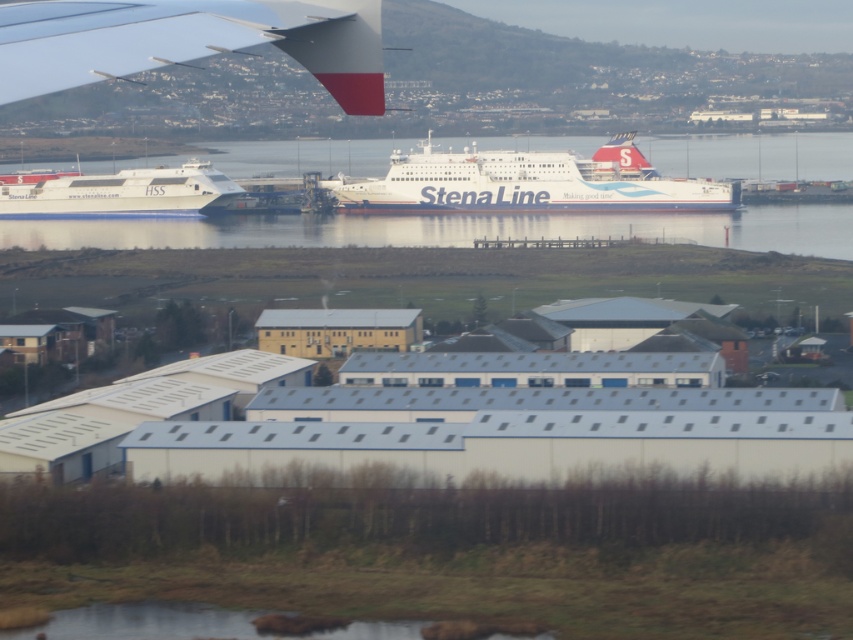
You are a photographer trying to capture both the white matte airplane wing at upper left and the white glossy ferry at left in the same frame. Which object should you focus on first if you want to ensure both are in focus?

You should focus on the white matte airplane wing at upper left first because it is taller than the white glossy ferry at left, so focusing on the farther object ensures both are in focus.

Based on the photo, you are a passenger on the airplane and looking out the window. You see the white glossy water at center and the white glossy ferry at left. Which one is located to the right of the other?

The white glossy water at center is positioned on the right side of the white glossy ferry at left.

You are a pilot reviewing the flight path and need to ensure the white matte airplane wing at upper left does not block the view of the ferries. Based on its position, can you confirm if the wing is positioned to the left of the ferries?

The white matte airplane wing at upper left is located at point (189, 40). Since the ferries are docked at the pier in the midground, which is further to the right compared to the wing, the wing is positioned to the left of the ferries.